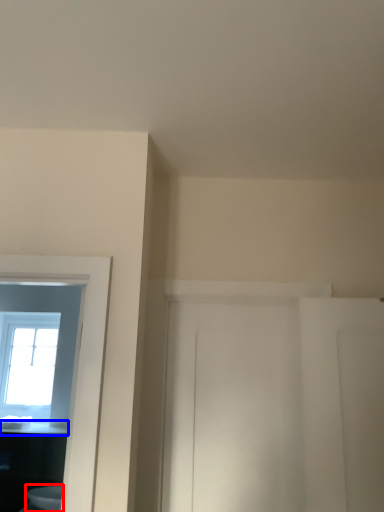
Question: Which point is further to the camera, toilet (highlighted by a red box) or counter top (highlighted by a blue box)?

Choices:
 (A) toilet
 (B) counter top

Answer: (B)